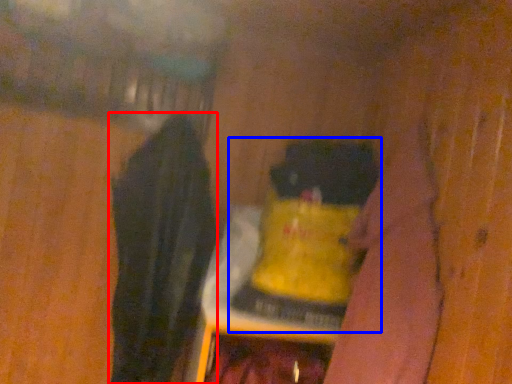
Question: Which of the following is the farthest to the observer, clothing (highlighted by a red box) or bottle (highlighted by a blue box)?

Choices:
 (A) clothing
 (B) bottle

Answer: (B)